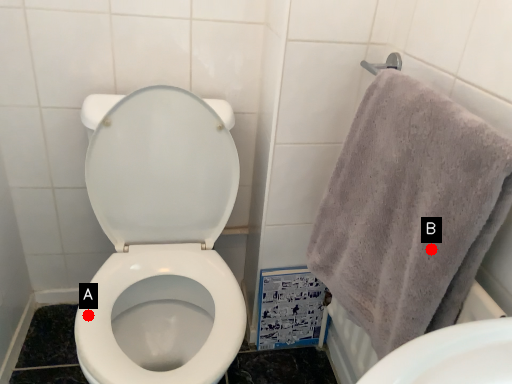
Question: Two points are circled on the image, labeled by A and B beside each circle. Which point appears closest to the camera in this image?

Choices:
 (A) A is closer
 (B) B is closer

Answer: (B)